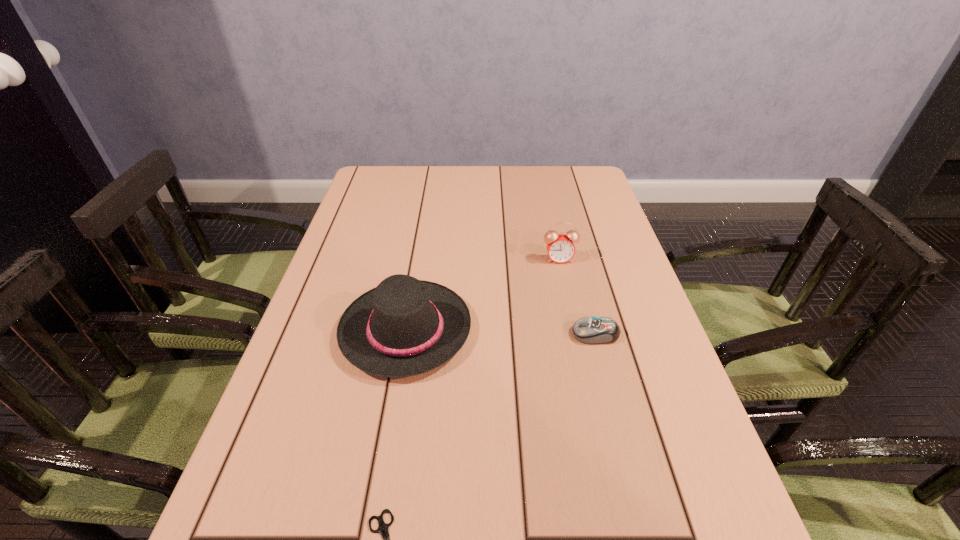
Image resolution: width=960 pixels, height=540 pixels. What are the coordinates of `alarm clock` in the screenshot? It's located at (560, 247).

Locate an element on the screen. dress hat is located at coordinates (404, 327).

At what (x,y) coordinates should I click in order to perform the action: click on the third tallest object. Please return your answer as a coordinate pair (x, y). This screenshot has width=960, height=540. Looking at the image, I should click on [590, 330].

At what (x,y) coordinates should I click in order to perform the action: click on free space located 0.170m on the clock face of the farthest object. Please return your answer as a coordinate pair (x, y). The height and width of the screenshot is (540, 960). Looking at the image, I should click on (570, 310).

I want to click on vacant point located 0.290m on the right of the dress hat, so click(x=600, y=330).

Find the location of a particular element. The height and width of the screenshot is (540, 960). free location located 0.390m on the wheel side of the second shortest object is located at coordinates (396, 334).

Where is `vacant space located 0.070m on the wheel side of the second shortest object`? This screenshot has height=540, width=960. vacant space located 0.070m on the wheel side of the second shortest object is located at coordinates (540, 334).

Identify the location of free space located 0.090m on the wheel side of the second shortest object. This screenshot has width=960, height=540. (532, 334).

You are a GUI agent. You are given a task and a screenshot of the screen. Output one action in this format:
    pyautogui.click(x=<x>, y=<y>)
    Task: Click on the object at the left edge
    
    Given the screenshot: What is the action you would take?
    pyautogui.click(x=404, y=327)

This screenshot has width=960, height=540. What are the coordinates of `alarm clock present at the right edge` in the screenshot? It's located at (560, 247).